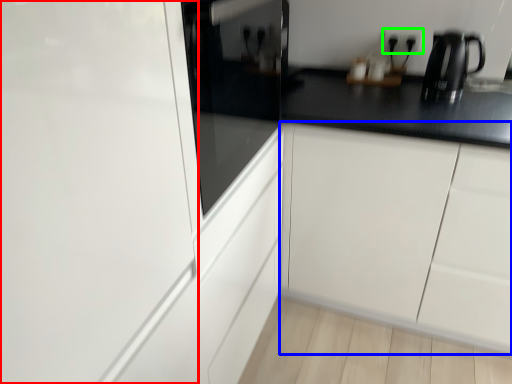
Question: Estimate the real-world distances between objects in this image. Which object is farther from glass door (highlighted by a red box), cabinetry (highlighted by a blue box) or electric outlet (highlighted by a green box)?

Choices:
 (A) cabinetry
 (B) electric outlet

Answer: (B)